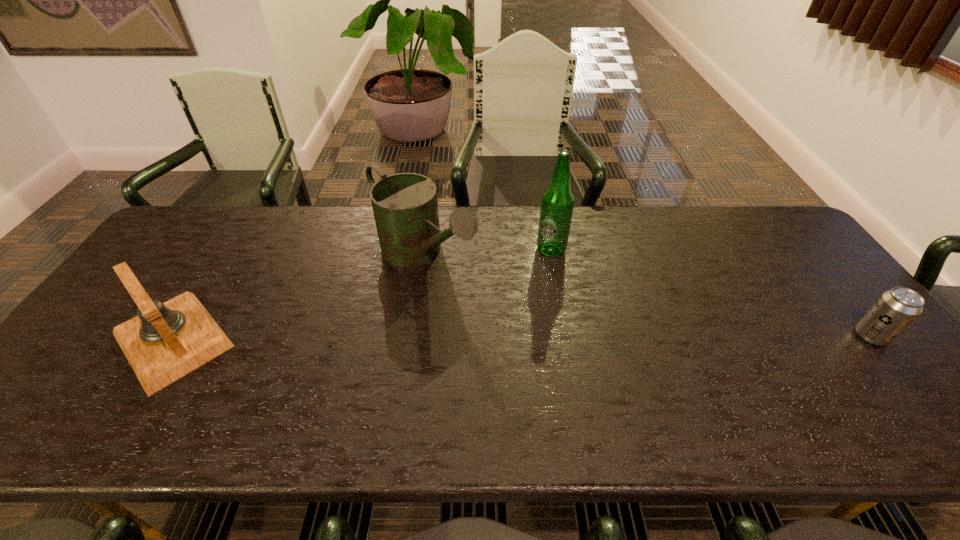
Find the location of `free space between the watering can and the third object from left to right`. free space between the watering can and the third object from left to right is located at coordinates (487, 253).

Locate an element on the screen. The width and height of the screenshot is (960, 540). empty space that is in between the leftmost object and the beer can is located at coordinates (522, 338).

You are a GUI agent. You are given a task and a screenshot of the screen. Output one action in this format:
    pyautogui.click(x=<x>, y=<y>)
    Task: Click on the free spot between the third object from right to left and the second shortest object
    The image size is (960, 540).
    Given the screenshot: What is the action you would take?
    pyautogui.click(x=298, y=298)

Identify the location of free area in between the beer can and the bell. This screenshot has width=960, height=540. (522, 338).

Find the location of a particular element. The image size is (960, 540). empty location between the leftmost object and the rightmost object is located at coordinates (522, 338).

Where is `unoccupied position between the tallest object and the beer can`? This screenshot has width=960, height=540. unoccupied position between the tallest object and the beer can is located at coordinates pyautogui.click(x=711, y=293).

Identify the location of free space between the watering can and the rightmost object. (647, 296).

Find the location of a particular element. The image size is (960, 540). empty space between the beer bottle and the rightmost object is located at coordinates (711, 293).

Locate an element on the screen. The height and width of the screenshot is (540, 960). free space between the shortest object and the leftmost object is located at coordinates (522, 338).

Identify the location of the closest object to the third object from right to left. (557, 202).